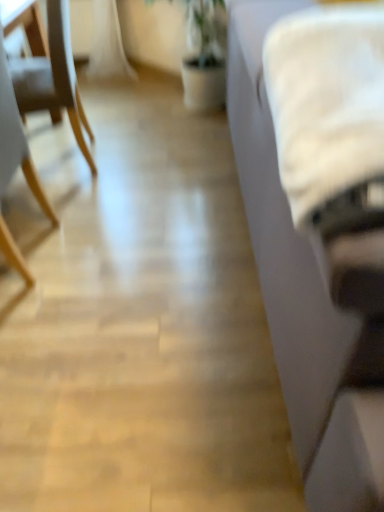
At what (x,y) coordinates should I click in order to perform the action: click on white fluffy blanket at right. Please return your answer as a coordinate pair (x, y). The image size is (384, 512). Looking at the image, I should click on (326, 101).

The image size is (384, 512). I want to click on wooden chair at left, placed as the second chair when sorted from back to front, so click(x=16, y=141).

Identify the location of white fluffy blanket at right. (326, 101).

How distant is white fabric couch at right from wooden chair at left, placed as the second chair when sorted from back to front?

white fabric couch at right is 38.37 inches from wooden chair at left, placed as the second chair when sorted from back to front.

Are white fabric couch at right and wooden chair at left, placed as the second chair when sorted from back to front, making contact?

No, white fabric couch at right is not touching wooden chair at left, placed as the second chair when sorted from back to front.

From a real-world perspective, is white fabric couch at right beneath wooden chair at left, placed as the second chair when sorted from back to front?

Yes.

Locate an element on the screen. studio couch that is under the wooden chair at left, which appears as the 1th chair when viewed from the front (from a real-world perspective) is located at coordinates (305, 301).

From the picture: From the image's perspective, is wooden chair at left, placed as the second chair when sorted from back to front, above or below white fluffy blanket at right?

From the image's perspective, wooden chair at left, placed as the second chair when sorted from back to front, appears above white fluffy blanket at right.

Can you confirm if wooden chair at left, which appears as the 1th chair when viewed from the front, is smaller than white fluffy blanket at right?

Actually, wooden chair at left, which appears as the 1th chair when viewed from the front, might be larger than white fluffy blanket at right.

This screenshot has height=512, width=384. I want to click on sheet in front of the wooden chair at left, which appears as the 1th chair when viewed from the front, so click(326, 101).

From the picture: Which is closer, (12,152) or (382,17)?

Positioned in front is point (382,17).

Considering the sizes of white fluffy blanket at right and wooden chair at left, placed as the second chair when sorted from back to front, in the image, is white fluffy blanket at right bigger or smaller than wooden chair at left, placed as the second chair when sorted from back to front,?

Clearly, white fluffy blanket at right is smaller in size than wooden chair at left, placed as the second chair when sorted from back to front.

Considering the sizes of objects white fluffy blanket at right and wooden chair at left, which appears as the 1th chair when viewed from the front, in the image provided, who is wider, white fluffy blanket at right or wooden chair at left, which appears as the 1th chair when viewed from the front,?

wooden chair at left, which appears as the 1th chair when viewed from the front, is wider.

From a real-world perspective, is white fluffy blanket at right beneath wooden chair at left, placed as the second chair when sorted from back to front?

No, from a real-world perspective, white fluffy blanket at right is not beneath wooden chair at left, placed as the second chair when sorted from back to front.

Which object is positioned more to the right, white fluffy blanket at right or wooden chair at left, which appears as the 1th chair when viewed from the front?

white fluffy blanket at right is more to the right.

Which is more to the right, light wood chair at left, which appears as the 1th chair when viewed from the back, or white fabric couch at right?

Positioned to the right is white fabric couch at right.

How far apart are light wood chair at left, which is the second chair from front to back, and white fabric couch at right?

light wood chair at left, which is the second chair from front to back, is 1.17 meters from white fabric couch at right.

Choose the correct answer: Is light wood chair at left, which appears as the 1th chair when viewed from the back, inside white fabric couch at right or outside it?

light wood chair at left, which appears as the 1th chair when viewed from the back, lies outside white fabric couch at right.

From a real-world perspective, is light wood chair at left, which appears as the 1th chair when viewed from the back, above or below white fabric couch at right?

light wood chair at left, which appears as the 1th chair when viewed from the back, is below white fabric couch at right.

Is white fabric couch at right facing away from white fluffy blanket at right?

No, white fluffy blanket at right is not at the back of white fabric couch at right.

Does white fabric couch at right appear on the left side of white fluffy blanket at right?

No, white fabric couch at right is not to the left of white fluffy blanket at right.

From a real-world perspective, is white fabric couch at right on white fluffy blanket at right?

Actually, white fabric couch at right is physically below white fluffy blanket at right in the real world.

Is white fabric couch at right touching white fluffy blanket at right?

white fabric couch at right and white fluffy blanket at right are not in contact.

Is wooden chair at left, which appears as the 1th chair when viewed from the front, to the left or to the right of light wood chair at left, which is the second chair from front to back, in the image?

wooden chair at left, which appears as the 1th chair when viewed from the front, is positioned on light wood chair at left, which is the second chair from front to back,'s left side.

Does wooden chair at left, placed as the second chair when sorted from back to front, turn towards light wood chair at left, which is the second chair from front to back?

No, wooden chair at left, placed as the second chair when sorted from back to front, is not turned towards light wood chair at left, which is the second chair from front to back.

Does wooden chair at left, placed as the second chair when sorted from back to front, contain light wood chair at left, which appears as the 1th chair when viewed from the back?

No, light wood chair at left, which appears as the 1th chair when viewed from the back, is located outside of wooden chair at left, placed as the second chair when sorted from back to front.

Considering the sizes of wooden chair at left, placed as the second chair when sorted from back to front, and light wood chair at left, which is the second chair from front to back, in the image, is wooden chair at left, placed as the second chair when sorted from back to front, wider or thinner than light wood chair at left, which is the second chair from front to back,?

Clearly, wooden chair at left, placed as the second chair when sorted from back to front, has less width compared to light wood chair at left, which is the second chair from front to back.

Which object is positioned more to the right, white fluffy blanket at right or light wood chair at left, which appears as the 1th chair when viewed from the back?

white fluffy blanket at right.

Consider the image. Could you tell me if white fluffy blanket at right is facing light wood chair at left, which is the second chair from front to back?

No, white fluffy blanket at right is not turned towards light wood chair at left, which is the second chair from front to back.

Considering the sizes of objects white fluffy blanket at right and light wood chair at left, which appears as the 1th chair when viewed from the back, in the image provided, who is smaller, white fluffy blanket at right or light wood chair at left, which appears as the 1th chair when viewed from the back,?

Smaller between the two is white fluffy blanket at right.

Where is `chair lying below the white fabric couch at right (from the image's perspective)`? The image size is (384, 512). chair lying below the white fabric couch at right (from the image's perspective) is located at coordinates (16, 141).

You are a GUI agent. You are given a task and a screenshot of the screen. Output one action in this format:
    pyautogui.click(x=<x>, y=<y>)
    Task: Click on the sheet located above the wooden chair at left, which appears as the 1th chair when viewed from the front (from a real-world perspective)
    The height and width of the screenshot is (512, 384).
    Given the screenshot: What is the action you would take?
    pyautogui.click(x=326, y=101)

Looking at the image, which one is located closer to wooden chair at left, placed as the second chair when sorted from back to front, white fabric couch at right or white fluffy blanket at right?

white fabric couch at right.

Based on their spatial positions, is white fabric couch at right or light wood chair at left, which is the second chair from front to back, closer to white fluffy blanket at right?

white fabric couch at right is positioned closer to the anchor white fluffy blanket at right.

Considering their positions, is light wood chair at left, which appears as the 1th chair when viewed from the back, positioned further to white fabric couch at right than white fluffy blanket at right?

Based on the image, light wood chair at left, which appears as the 1th chair when viewed from the back, appears to be further to white fabric couch at right.

When comparing their distances from light wood chair at left, which appears as the 1th chair when viewed from the back, does wooden chair at left, placed as the second chair when sorted from back to front, or white fabric couch at right seem further?

Result: white fabric couch at right is positioned further to the anchor light wood chair at left, which appears as the 1th chair when viewed from the back.

Based on their spatial positions, is light wood chair at left, which is the second chair from front to back, or white fluffy blanket at right further from wooden chair at left, placed as the second chair when sorted from back to front?

white fluffy blanket at right lies further to wooden chair at left, placed as the second chair when sorted from back to front, than the other object.

Based on the photo, considering their positions, is white fabric couch at right positioned closer to wooden chair at left, which appears as the 1th chair when viewed from the front, than light wood chair at left, which appears as the 1th chair when viewed from the back?

light wood chair at left, which appears as the 1th chair when viewed from the back.

Estimate the real-world distances between objects in this image. Which object is closer to light wood chair at left, which is the second chair from front to back, white fabric couch at right or wooden chair at left, which appears as the 1th chair when viewed from the front?

wooden chair at left, which appears as the 1th chair when viewed from the front, is closer to light wood chair at left, which is the second chair from front to back.

When comparing their distances from wooden chair at left, placed as the second chair when sorted from back to front, does white fluffy blanket at right or light wood chair at left, which appears as the 1th chair when viewed from the back, seem further?

white fluffy blanket at right.

Find the location of a particular element. The height and width of the screenshot is (512, 384). chair located between white fluffy blanket at right and light wood chair at left, which appears as the 1th chair when viewed from the back, in the depth direction is located at coordinates (16, 141).

The width and height of the screenshot is (384, 512). In order to click on chair between wooden chair at left, which appears as the 1th chair when viewed from the front, and white fabric couch at right in this screenshot , I will do `click(53, 77)`.

What are the coordinates of `sheet located between white fabric couch at right and light wood chair at left, which is the second chair from front to back, in the depth direction` in the screenshot? It's located at (326, 101).

Where is `sheet between wooden chair at left, placed as the second chair when sorted from back to front, and white fabric couch at right, in the horizontal direction`? sheet between wooden chair at left, placed as the second chair when sorted from back to front, and white fabric couch at right, in the horizontal direction is located at coordinates (326, 101).